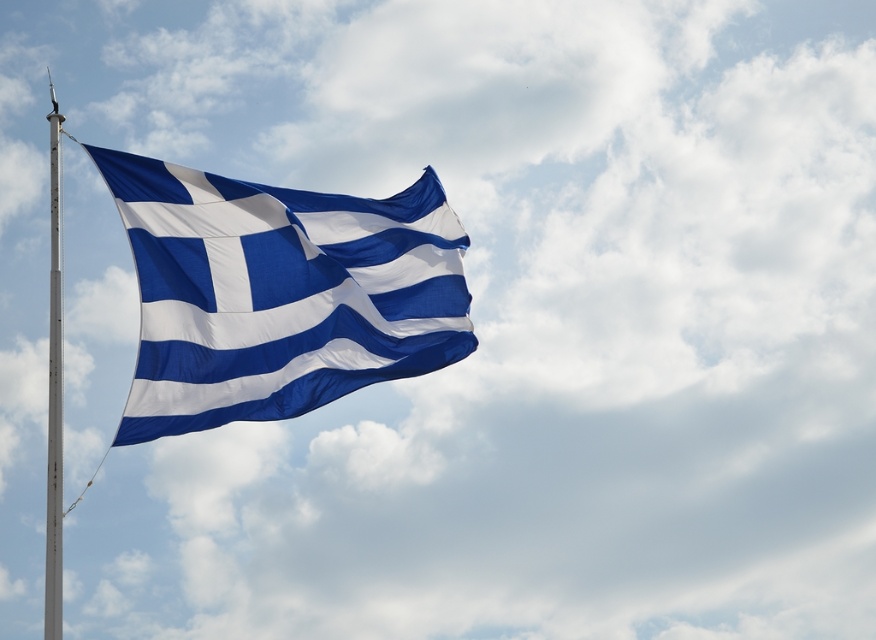
You are a photographer trying to capture the Greek flag in the image. The flag is represented by the point at coordinates point (277,294). Where should you position your camera to ensure the flag is centered in your shot?

To center the flag represented by point (277,294) in your shot, position your camera so that the point is at the center of the frame.

You are a photographer trying to capture the blue fabric flag at upper left in the center of your camera frame. Given the flag is at coordinates 0.461 on the x and 0.317 on the y axis, will the flag be centered if your camera frame is set to focus at the center point of the image?

The blue fabric flag at upper left is located at point (277, 294), which is not the exact center of the image. Therefore, the flag will not be centered in the camera frame if focused at the center point of the image.

You are a photographer aiming to capture the blue fabric flag at upper left and the white metallic pole at left in a single shot. Since the flag is above the pole, where should you position your camera relative to the pole to ensure both are in frame?

The blue fabric flag at upper left is above the white metallic pole at left, so you should position your camera below the pole to capture both the flag and the pole in the frame.